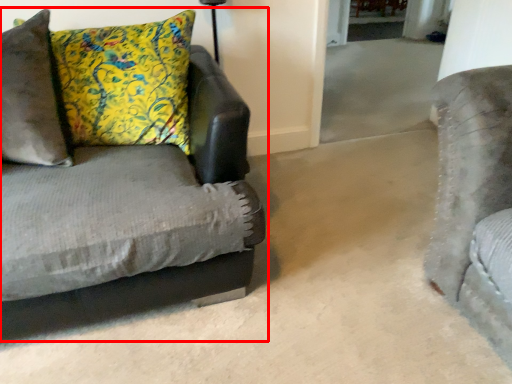
Question: From the image's perspective, what is the correct spatial relationship of studio couch (annotated by the red box) in relation to pillow?

Choices:
 (A) above
 (B) below

Answer: (B)